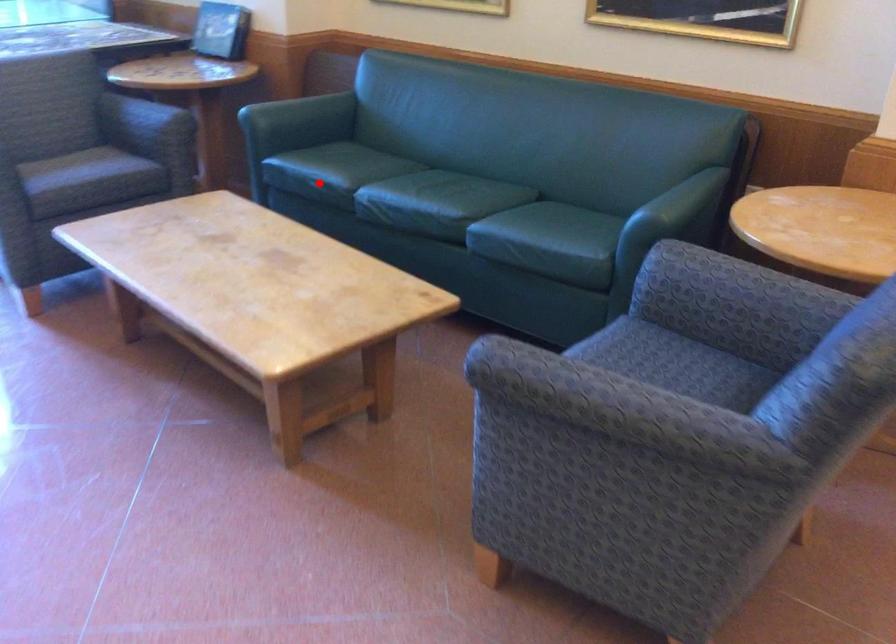
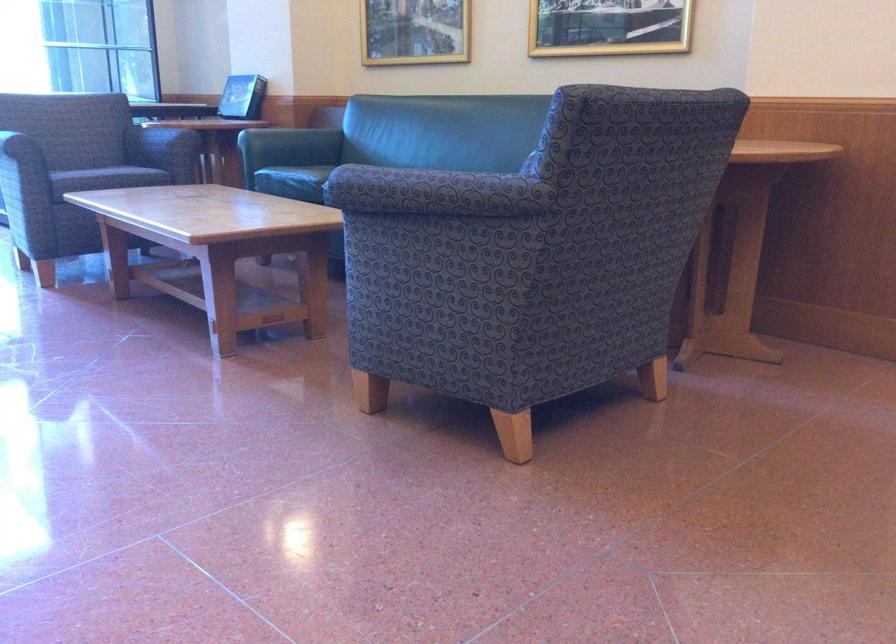
In the second image, find the point that corresponds to the highlighted location in the first image.

(293, 182)